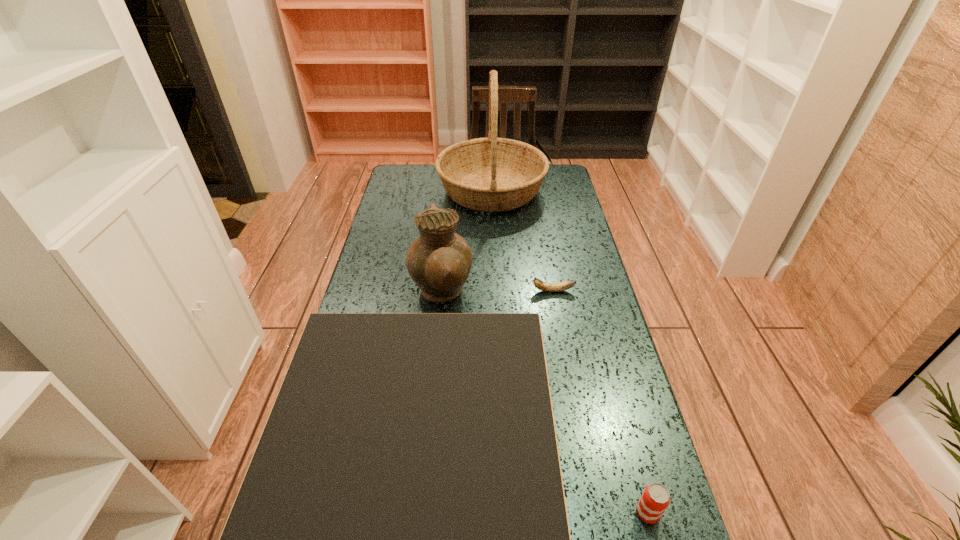
Where is `the tallest object`? The height and width of the screenshot is (540, 960). the tallest object is located at coordinates (490, 174).

This screenshot has height=540, width=960. I want to click on the farthest object, so click(x=490, y=174).

I want to click on pitcher, so click(439, 261).

I want to click on the rightmost object, so click(x=655, y=499).

Identify the location of the fourth tallest object. The image size is (960, 540). (655, 499).

Image resolution: width=960 pixels, height=540 pixels. In order to click on the shortest object in this screenshot , I will do `click(544, 286)`.

Find the location of a particular element. The width and height of the screenshot is (960, 540). vacant space located on the front of the basket is located at coordinates (495, 292).

I want to click on free region located 0.330m at the spout of the pitcher, so click(x=579, y=293).

At what (x,y) coordinates should I click in order to perform the action: click on blank space located 0.370m on the back of the rightmost object. Please return your answer as a coordinate pair (x, y). The image size is (960, 540). Looking at the image, I should click on (606, 357).

Find the location of a particular element. Image resolution: width=960 pixels, height=540 pixels. free space located 0.140m on the peel of the banana is located at coordinates (486, 291).